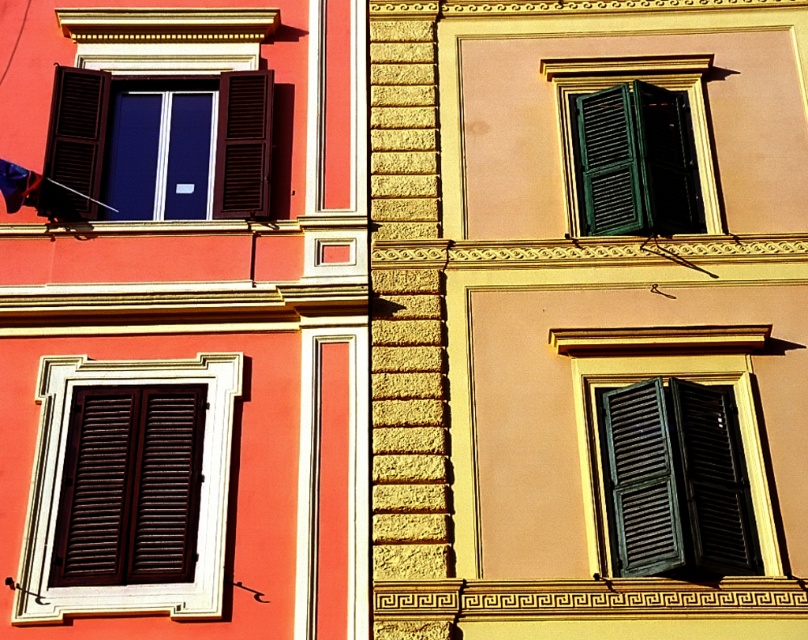
Question: Which object appears closest to the camera in this image?

Choices:
 (A) blue fabric flag at upper left
 (B) matte brown shutter at upper left

Answer: (B)

Question: Can you confirm if matte brown shutters at lower left is bigger than matte brown shutter at upper left?

Choices:
 (A) yes
 (B) no

Answer: (A)

Question: Estimate the real-world distances between objects in this image. Which object is farther from the matte brown shutter at upper left?

Choices:
 (A) matte brown shutters at lower left
 (B) green matte shutters at lower right
 (C) green matte shutters at upper right

Answer: (B)

Question: Can you confirm if matte brown shutter at upper left is positioned to the left of blue fabric flag at upper left?

Choices:
 (A) no
 (B) yes

Answer: (A)

Question: Does green matte shutters at lower right appear over blue fabric flag at upper left?

Choices:
 (A) yes
 (B) no

Answer: (B)

Question: Which point is closer to the camera?

Choices:
 (A) (562, 65)
 (B) (86, 490)
 (C) (19, 182)
 (D) (76, 116)

Answer: (B)